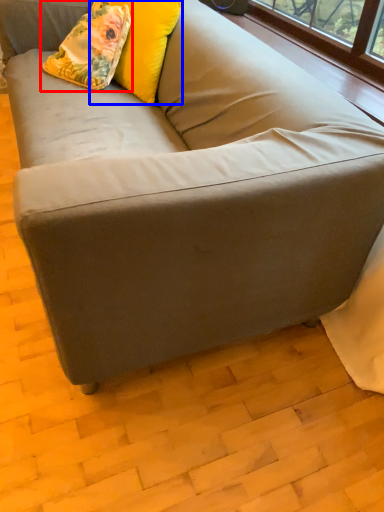
Question: Which object appears farthest to the camera in this image, throw pillow (highlighted by a red box) or pillow (highlighted by a blue box)?

Choices:
 (A) throw pillow
 (B) pillow

Answer: (A)